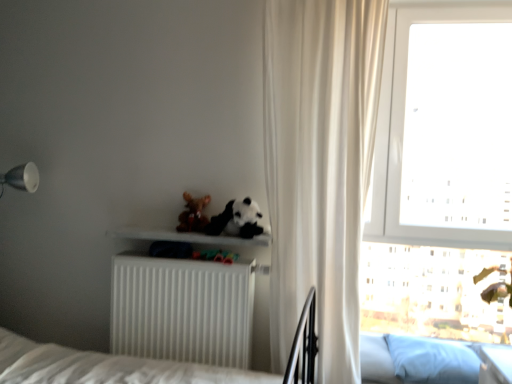
Question: Does fuzzy brown teddy bear at center appear on the left side of blue fabric pillow at lower right?

Choices:
 (A) yes
 (B) no

Answer: (A)

Question: Is fuzzy brown teddy bear at center far away from blue fabric pillow at lower right?

Choices:
 (A) no
 (B) yes

Answer: (B)

Question: Is fuzzy brown teddy bear at center oriented towards blue fabric pillow at lower right?

Choices:
 (A) no
 (B) yes

Answer: (A)

Question: Does fuzzy brown teddy bear at center have a larger size compared to blue fabric pillow at lower right?

Choices:
 (A) yes
 (B) no

Answer: (B)

Question: Does fuzzy brown teddy bear at center have a lesser width compared to blue fabric pillow at lower right?

Choices:
 (A) yes
 (B) no

Answer: (A)

Question: Is fuzzy brown teddy bear at center surrounding blue fabric pillow at lower right?

Choices:
 (A) no
 (B) yes

Answer: (A)

Question: Does white matte radiator at lower center turn towards fuzzy brown teddy bear at center?

Choices:
 (A) no
 (B) yes

Answer: (A)

Question: Can you confirm if white matte radiator at lower center is thinner than fuzzy brown teddy bear at center?

Choices:
 (A) no
 (B) yes

Answer: (A)

Question: Can you confirm if white matte radiator at lower center is wider than fuzzy brown teddy bear at center?

Choices:
 (A) no
 (B) yes

Answer: (B)

Question: From a real-world perspective, is white matte radiator at lower center under fuzzy brown teddy bear at center?

Choices:
 (A) no
 (B) yes

Answer: (B)

Question: Considering the relative positions of white matte radiator at lower center and fuzzy brown teddy bear at center in the image provided, is white matte radiator at lower center behind fuzzy brown teddy bear at center?

Choices:
 (A) yes
 (B) no

Answer: (B)

Question: Is white matte radiator at lower center far away from fuzzy brown teddy bear at center?

Choices:
 (A) no
 (B) yes

Answer: (A)

Question: Is white matte radiator at lower center at the back of transparent glass window at upper right?

Choices:
 (A) no
 (B) yes

Answer: (A)